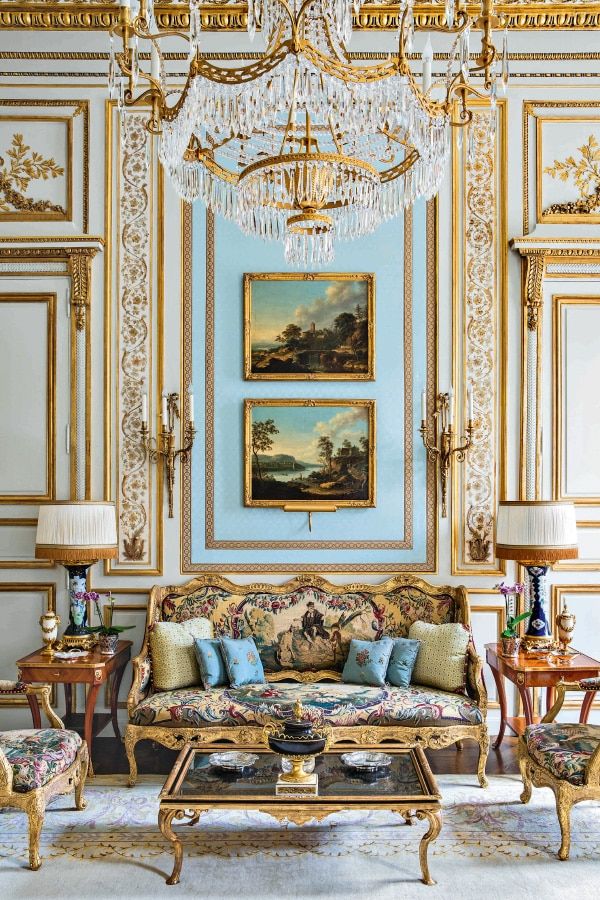
At what (x,y) coordinates should I click in order to perform the action: click on beige pillows. Please return your answer as a coordinate pair (x, y). Looking at the image, I should click on (167, 654), (431, 659).